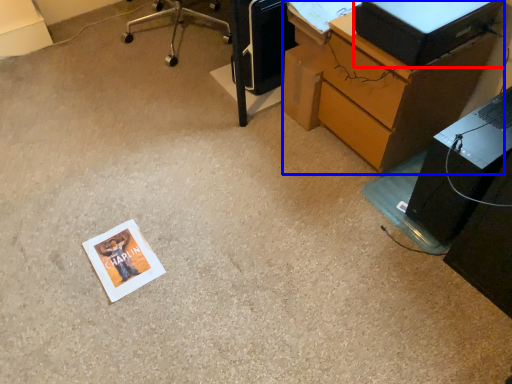
Question: Which point is closer to the camera, desktop computer (highlighted by a red box) or desk (highlighted by a blue box)?

Choices:
 (A) desktop computer
 (B) desk

Answer: (A)